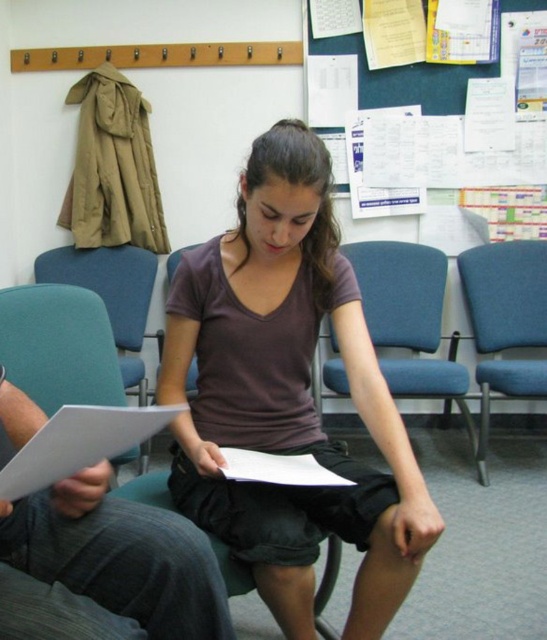
Question: Can you confirm if brown matte shirt at center is thinner than blue fabric chair at center?

Choices:
 (A) yes
 (B) no

Answer: (A)

Question: Is brown matte shirt at center below white paper at center?

Choices:
 (A) yes
 (B) no

Answer: (B)

Question: Among these points, which one is farthest from the camera?

Choices:
 (A) (458, 397)
 (B) (456, 72)
 (C) (537, 250)

Answer: (B)

Question: Is brown matte shirt at center in front of blue fabric bulletin board at upper center?

Choices:
 (A) no
 (B) yes

Answer: (B)

Question: Estimate the real-world distances between objects in this image. Which object is farther from the white paper at center?

Choices:
 (A) brown matte shirt at center
 (B) blue fabric chair at center
 (C) blue fabric chair at right

Answer: (C)

Question: Among these objects, which one is farthest from the camera?

Choices:
 (A) brown matte shirt at center
 (B) blue fabric chair at center
 (C) blue fabric bulletin board at upper center

Answer: (C)